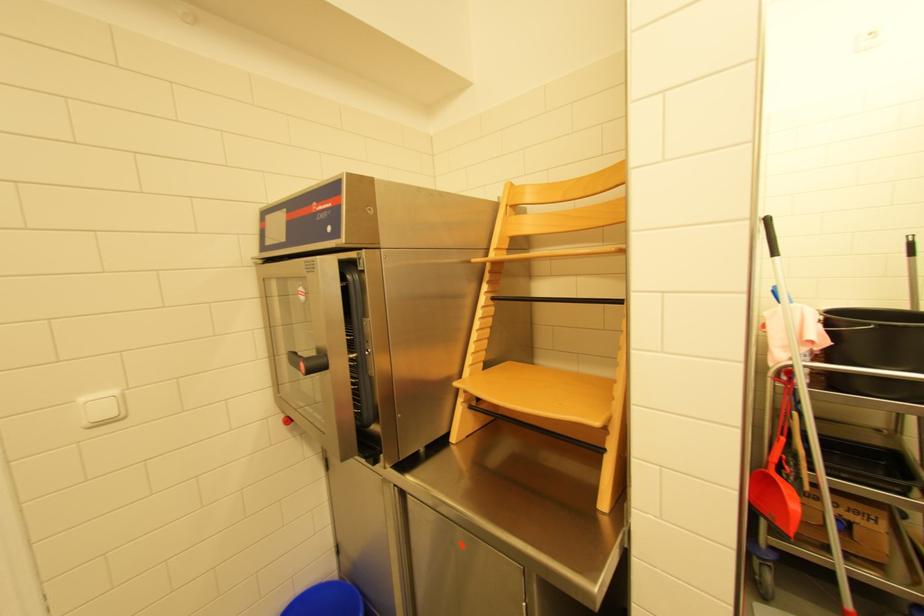
The image size is (924, 616). I want to click on chair sitting surface, so click(560, 392).